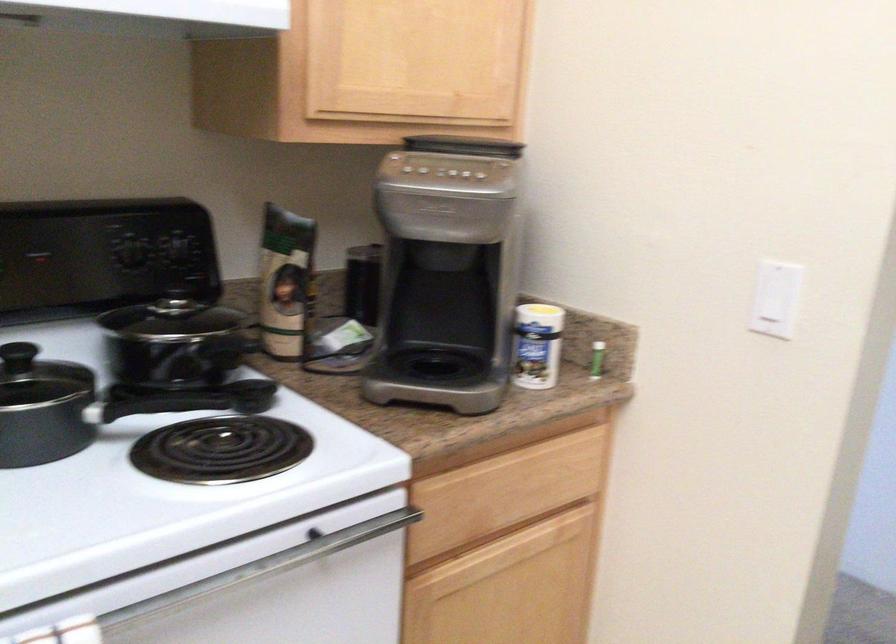
Locate an element on the screen. This screenshot has width=896, height=644. white spice container is located at coordinates (536, 345).